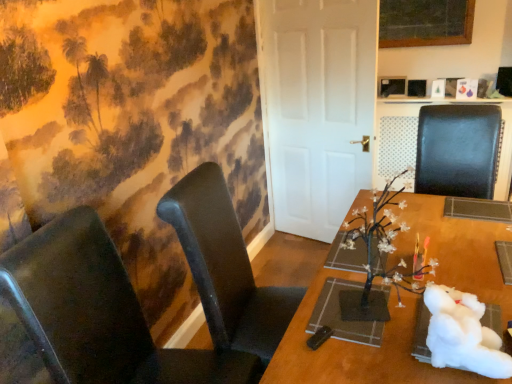
Question: From a real-world perspective, is black leather chair at left, which appears as the 2th chair when viewed from the right, above or below black leather chair at right, marked as the 3th chair in a left-to-right arrangement?

Choices:
 (A) below
 (B) above

Answer: (A)

Question: Is black leather chair at left, which appears as the 2th chair when viewed from the right, in front of or behind black leather chair at right, the first chair positioned from the right, in the image?

Choices:
 (A) behind
 (B) front

Answer: (B)

Question: Which of these objects is positioned closest to the wooden table at center?

Choices:
 (A) black leather chair at left, which appears as the 2th chair when viewed from the right
 (B) black leather chair at right, the first chair positioned from the right
 (C) white matte door at center
 (D) matte black chair at left, positioned as the 3th chair in right-to-left order

Answer: (A)

Question: Which object is the closest to the white matte door at center?

Choices:
 (A) black leather chair at left, the second chair viewed from the left
 (B) black leather chair at right, the first chair positioned from the right
 (C) matte black chair at left, positioned as the 3th chair in right-to-left order
 (D) wooden table at center

Answer: (B)